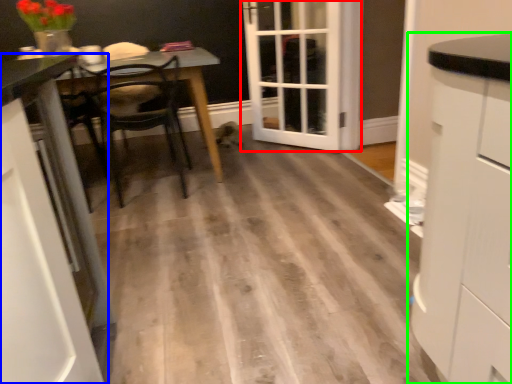
Question: Which object is the farthest from door (highlighted by a red box)? Choose among these: cabinetry (highlighted by a blue box) or cabinetry (highlighted by a green box).

Choices:
 (A) cabinetry
 (B) cabinetry

Answer: (A)